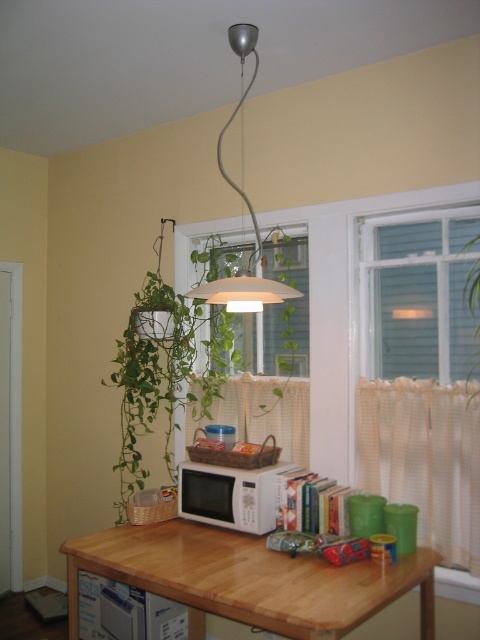
Question: Which object is positioned farthest from the metallic pendant light at center?

Choices:
 (A) wooden table at center
 (B) white sheer curtain at lower right
 (C) white sheer curtain at center

Answer: (A)

Question: From the image, what is the correct spatial relationship of white sheer curtain at lower right in relation to white matte microwave at center?

Choices:
 (A) above
 (B) below

Answer: (A)

Question: Does clear glass window at upper right appear on the left side of transparent glass window at center?

Choices:
 (A) no
 (B) yes

Answer: (A)

Question: Does wooden table at center have a lesser width compared to white matte microwave at center?

Choices:
 (A) no
 (B) yes

Answer: (A)

Question: Estimate the real-world distances between objects in this image. Which object is closer to the wooden table at center?

Choices:
 (A) green leafy plant at center
 (B) clear glass window at upper right
 (C) metallic pendant light at center

Answer: (A)

Question: Considering the real-world distances, which object is closest to the green leafy plant at center?

Choices:
 (A) white matte microwave at center
 (B) wooden table at center
 (C) clear glass window at upper right
 (D) metallic pendant light at center

Answer: (A)